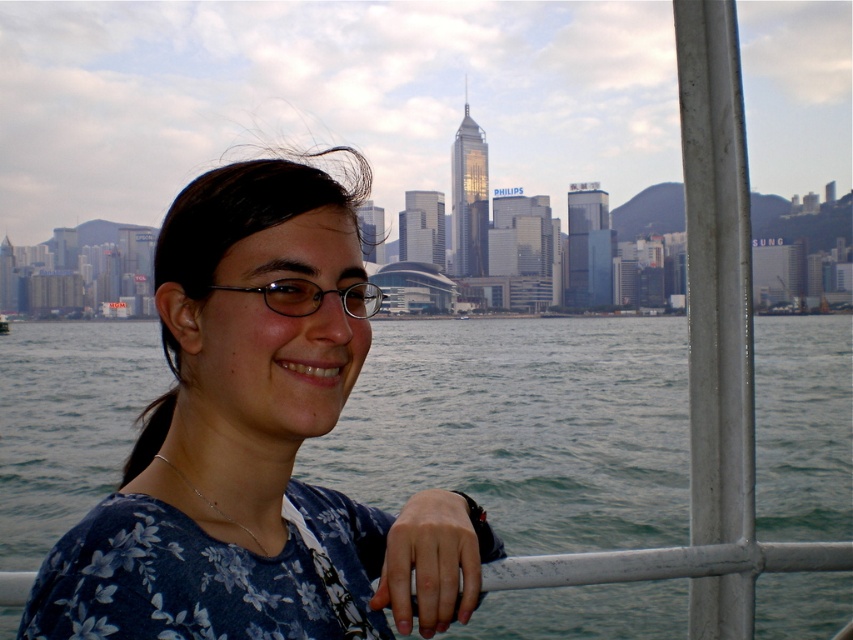
Can you confirm if greenish-blue water at center is bigger than blue floral shirt at center?

Indeed, greenish-blue water at center has a larger size compared to blue floral shirt at center.

Is the position of greenish-blue water at center less distant than that of blue floral shirt at center?

No, greenish-blue water at center is behind blue floral shirt at center.

Where is `greenish-blue water at center`? The width and height of the screenshot is (853, 640). greenish-blue water at center is located at coordinates (523, 428).

From the picture: Can you confirm if blue floral shirt at center is wider than clear plastic glasses at center?

Indeed, blue floral shirt at center has a greater width compared to clear plastic glasses at center.

Is blue floral shirt at center to the right of clear plastic glasses at center from the viewer's perspective?

Incorrect, blue floral shirt at center is not on the right side of clear plastic glasses at center.

Is point (293, 204) positioned behind point (271, 282)?

No, it is in front of (271, 282).

Image resolution: width=853 pixels, height=640 pixels. In order to click on blue floral shirt at center in this screenshot , I will do `click(254, 449)`.

Is the position of greenish-blue water at center less distant than that of clear plastic glasses at center?

No, greenish-blue water at center is behind clear plastic glasses at center.

Can you confirm if greenish-blue water at center is taller than clear plastic glasses at center?

Yes, greenish-blue water at center is taller than clear plastic glasses at center.

Is point (839, 500) positioned behind point (297, 284)?

Yes.

The width and height of the screenshot is (853, 640). In order to click on greenish-blue water at center in this screenshot , I will do `click(523, 428)`.